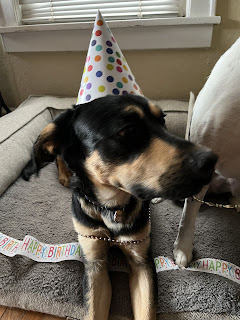
This screenshot has width=240, height=320. Identify the location of white fur. (224, 102).